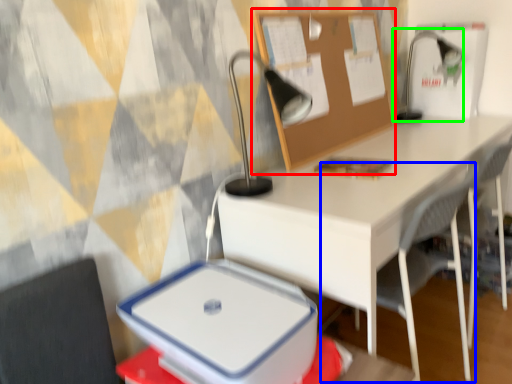
Question: Considering the real-world distances, which object is farthest from bulletin board (highlighted by a red box)? armchair (highlighted by a blue box) or table lamp (highlighted by a green box)?

Choices:
 (A) armchair
 (B) table lamp

Answer: (B)